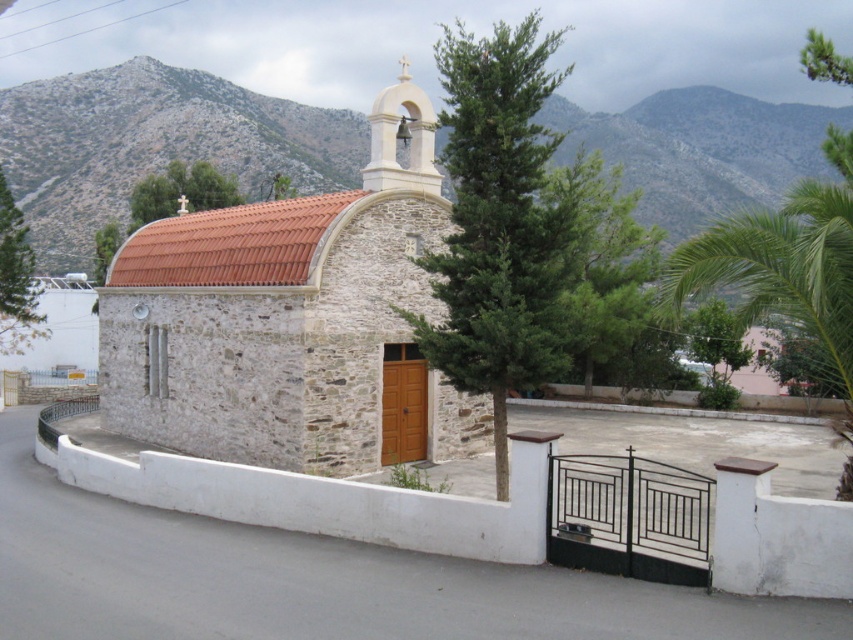
Question: Which point is closer to the camera?

Choices:
 (A) (685, 138)
 (B) (444, 220)

Answer: (B)

Question: Estimate the real-world distances between objects in this image. Which object is closer to the green leafy palm tree at center?

Choices:
 (A) green leafy tree at upper center
 (B) stone church at center

Answer: (B)

Question: Is gray rocky mountain at upper center below green leafy palm tree at center?

Choices:
 (A) yes
 (B) no

Answer: (B)

Question: Is gray rocky mountain at upper center thinner than green leafy tree at upper center?

Choices:
 (A) no
 (B) yes

Answer: (A)

Question: Can you confirm if stone church at center is positioned to the left of green leafy tree at upper center?

Choices:
 (A) no
 (B) yes

Answer: (A)

Question: Which object appears closest to the camera in this image?

Choices:
 (A) green leafy tree at upper center
 (B) stone church at center
 (C) green leafy palm tree at center
 (D) gray rocky mountain at upper center

Answer: (C)